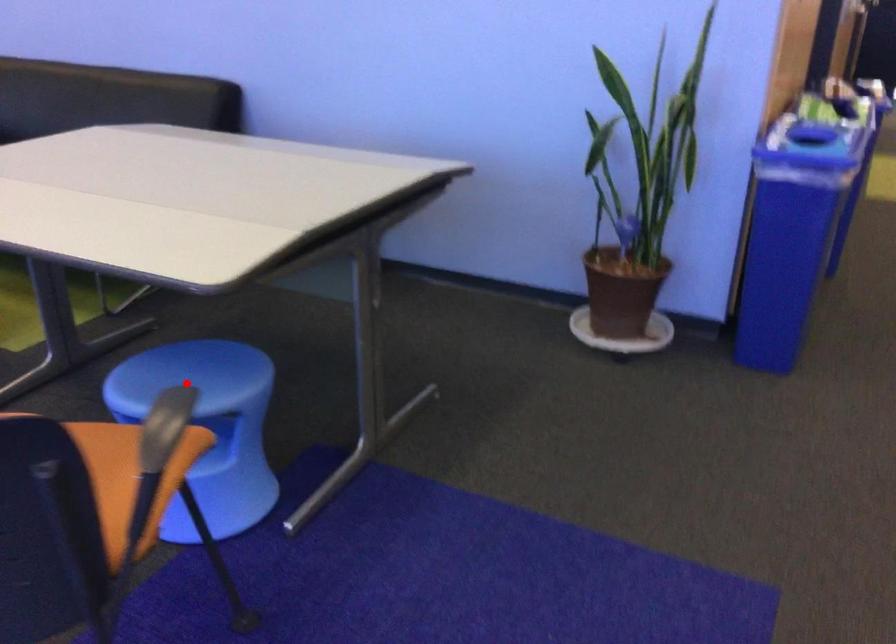
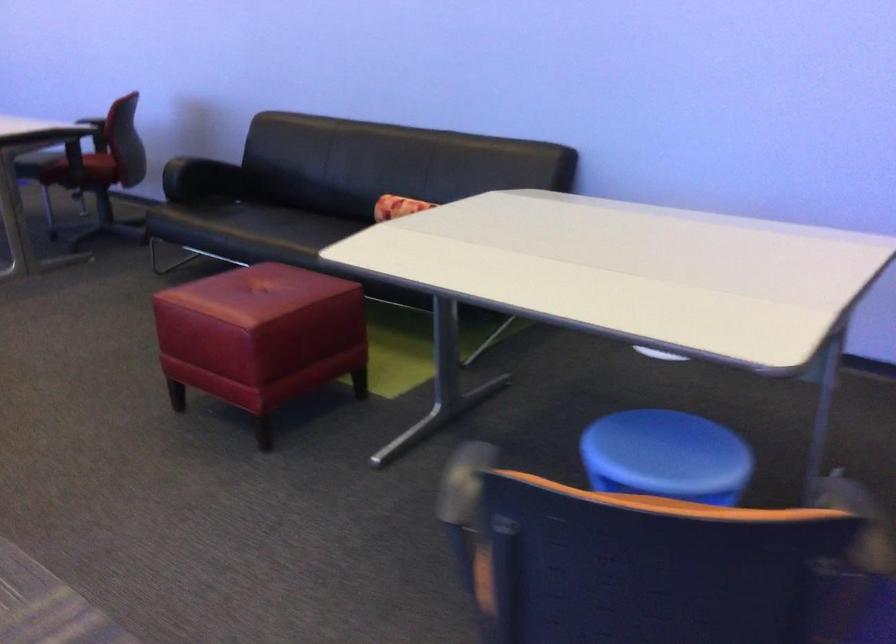
In the second image, find the point that corresponds to the highlighted location in the first image.

(666, 456)